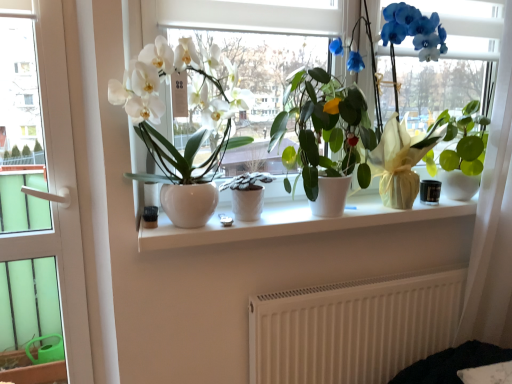
Question: Considering the relative sizes of white sheer curtain at right and white ceramic window sill at center in the image provided, is white sheer curtain at right smaller than white ceramic window sill at center?

Choices:
 (A) yes
 (B) no

Answer: (B)

Question: From a real-world perspective, is white sheer curtain at right positioned over white ceramic window sill at center based on gravity?

Choices:
 (A) yes
 (B) no

Answer: (A)

Question: Can white ceramic window sill at center be found inside white sheer curtain at right?

Choices:
 (A) no
 (B) yes

Answer: (A)

Question: Is white sheer curtain at right closer to camera compared to white ceramic window sill at center?

Choices:
 (A) yes
 (B) no

Answer: (B)

Question: Is white sheer curtain at right further to the viewer compared to white ceramic window sill at center?

Choices:
 (A) no
 (B) yes

Answer: (B)

Question: From a real-world perspective, is white sheer curtain at right below white ceramic window sill at center?

Choices:
 (A) yes
 (B) no

Answer: (B)

Question: From a real-world perspective, is white textured pot at center, the second houseplant in the left-to-right sequence, located beneath white glossy vase at center?

Choices:
 (A) no
 (B) yes

Answer: (B)

Question: Considering the relative sizes of white textured pot at center, which appears as the 2th houseplant when viewed from the right, and white glossy vase at center in the image provided, is white textured pot at center, which appears as the 2th houseplant when viewed from the right, wider than white glossy vase at center?

Choices:
 (A) no
 (B) yes

Answer: (B)

Question: Is white glossy vase at center a part of white textured pot at center, which appears as the 2th houseplant when viewed from the right?

Choices:
 (A) no
 (B) yes

Answer: (A)

Question: From the image's perspective, does white textured pot at center, which appears as the 2th houseplant when viewed from the right, appear higher than white glossy vase at center?

Choices:
 (A) yes
 (B) no

Answer: (B)

Question: Considering the relative sizes of white textured pot at center, the second houseplant in the left-to-right sequence, and white glossy vase at center in the image provided, is white textured pot at center, the second houseplant in the left-to-right sequence, taller than white glossy vase at center?

Choices:
 (A) no
 (B) yes

Answer: (A)

Question: From a real-world perspective, is white textured pot at center, the second houseplant in the left-to-right sequence, located higher than white glossy vase at center?

Choices:
 (A) yes
 (B) no

Answer: (B)

Question: Can you confirm if white textured pot at center, the second houseplant in the left-to-right sequence, is smaller than white ceramic window sill at center?

Choices:
 (A) yes
 (B) no

Answer: (A)